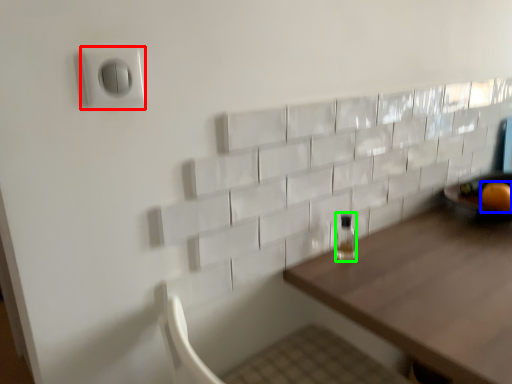
Question: Which object is positioned closest to electric outlet (highlighted by a red box)? Select from orange (highlighted by a blue box) and bottle (highlighted by a green box).

Choices:
 (A) orange
 (B) bottle

Answer: (B)